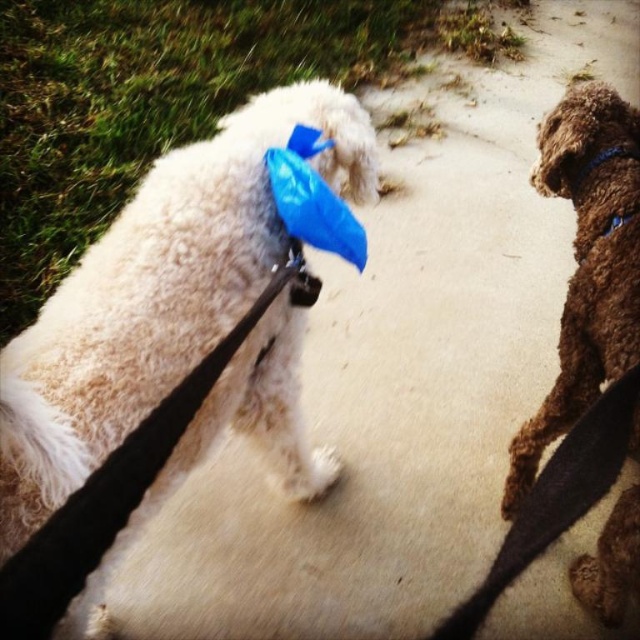
From the picture: You are a dog owner who wants to buy a new harness for both dogs. The harness you found is labeled as suitable for dogs weighing up to 25 kg. If the white fluffy dog at upper left weighs twice as much as the brown fuzzy dog at right, can both dogs use the same harness?

The white fluffy dog at upper left is bigger than brown fuzzy dog at right. If the white fluffy dog at upper left weighs twice as much as the brown fuzzy dog at right, then the brown fuzzy dog at right weighs half of the white dog. Since the harness is suitable for up to 25 kg, the white dog must weigh less than or equal to 25 kg. Therefore, the brown dog would weigh 12.5 kg or less, so both dogs can use the same harness as long as the white fluffy dog at upper left is within the 25 kg limit.

Based on the photo, you are a photographer trying to capture a closeup of the white fluffy dog at upper left and the black leather leash at lower right. Which object should you focus on first to ensure it appears sharp in the photo?

The white fluffy dog at upper left is closer to the viewer than the black leather leash at lower right, so you should focus on the white fluffy dog at upper left first to ensure it appears sharp in the photo.

You are a photographer standing at the center of the sandy path. You want to take a photo of the white fluffy dog at upper left. Where should you position your camera to capture the dog in the frame?

The white fluffy dog at upper left is located at coordinates 0.461 on the x axis and 0.247 on the y axis, so you should position your camera to aim towards those coordinates to capture the dog in the frame.